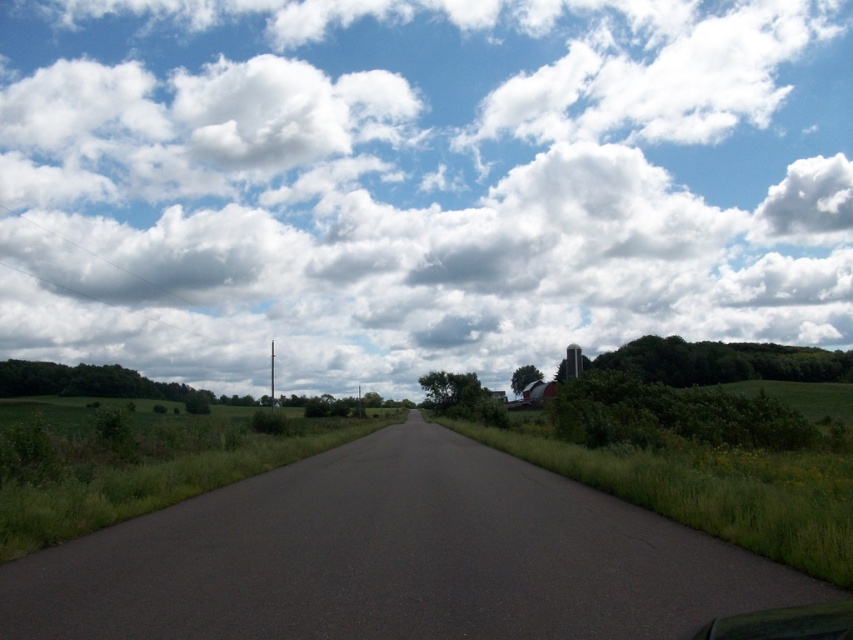
You are standing at the starting point of the road in this rural scene. You notice two points marked on the image. The first point is at coordinates point (489, 356) and the second is at point (723, 634). If you want to reach the point that is closer to you, which coordinate should you head towards?

The point closer to you is point (723, 634) because the description states that point (489, 356) is further to the camera than point (723, 634).

You are a driver in a green matte car at lower right and you want to park on the dark asphalt road at center. Can you park your car on the road?

The dark asphalt road at center has a greater height compared to green matte car at lower right, so the car cannot park on the road due to the height difference.

You are driving a green matte car at lower right and want to park under a white fluffy cloud at upper center for shade. Is the cloud positioned to the left or right of your car?

The white fluffy cloud at upper center is to the left of the green matte car at lower right, so parking there would place the car under the cloud for shade.